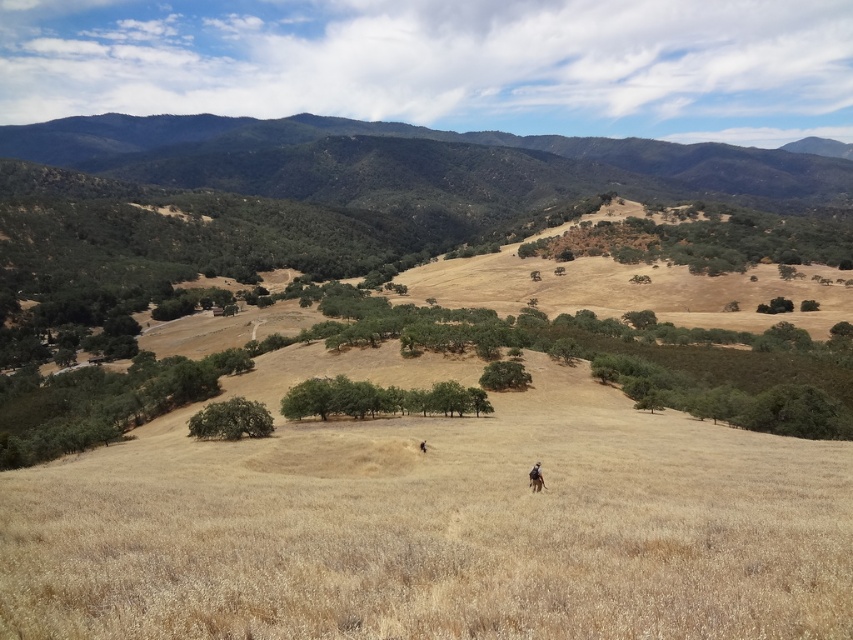
Question: Does green leafy trees at center have a lesser width compared to brown leather jacket at center?

Choices:
 (A) yes
 (B) no

Answer: (B)

Question: Which of these objects is positioned farthest from the green matte tree at center-left?

Choices:
 (A) green leafy trees at center
 (B) brown leather jacket at center
 (C) brown leather backpack at center

Answer: (C)

Question: Estimate the real-world distances between objects in this image. Which object is farther from the green leafy trees at center?

Choices:
 (A) brown leather jacket at center
 (B) green matte tree at center-left
 (C) brown leather backpack at center

Answer: (C)

Question: Which of the following is the farthest from the observer?

Choices:
 (A) (419, 442)
 (B) (258, 426)

Answer: (B)

Question: Is brown leather backpack at center positioned in front of brown leather jacket at center?

Choices:
 (A) yes
 (B) no

Answer: (A)

Question: Is green leafy trees at center above green matte tree at center-left?

Choices:
 (A) no
 (B) yes

Answer: (B)